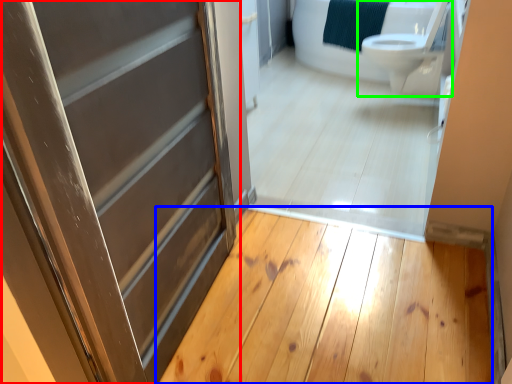
Question: Considering the real-world distances, which object is farthest from door (highlighted by a red box)? plank (highlighted by a blue box) or toilet (highlighted by a green box)?

Choices:
 (A) plank
 (B) toilet

Answer: (B)